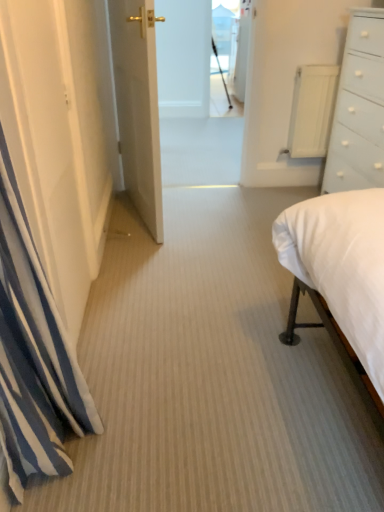
Image resolution: width=384 pixels, height=512 pixels. What are the coordinates of `unoccupied area behind white striped curtain at left` in the screenshot? It's located at (129, 369).